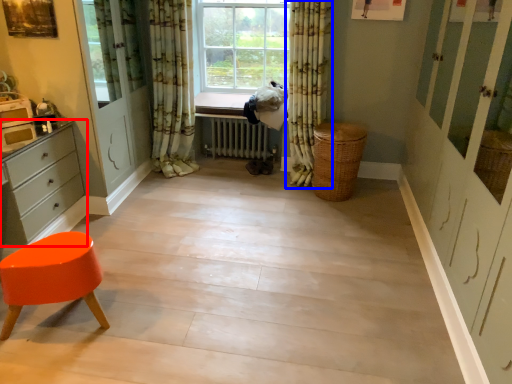
Question: Which of the following is the closest to the observer, chest of drawers (highlighted by a red box) or curtain (highlighted by a blue box)?

Choices:
 (A) chest of drawers
 (B) curtain

Answer: (A)